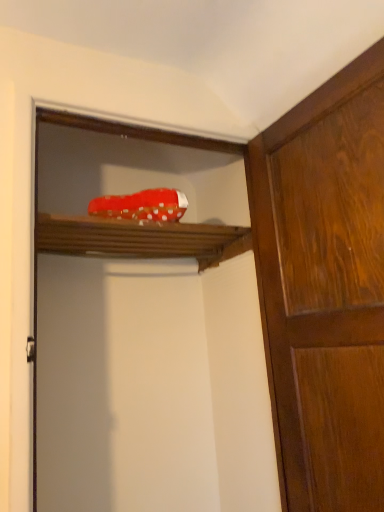
Measure the distance between wooden shelf at upper center and camera.

wooden shelf at upper center and camera are 1.16 meters apart from each other.

What do you see at coordinates (325, 287) in the screenshot? I see `wooden cabinet at right` at bounding box center [325, 287].

The height and width of the screenshot is (512, 384). Identify the location of wooden shelf at upper center. [140, 239].

Looking at their sizes, would you say red fabric shoe at upper center is wider or thinner than wooden shelf at upper center?

In the image, red fabric shoe at upper center appears to be more narrow than wooden shelf at upper center.

Which is in front, red fabric shoe at upper center or wooden shelf at upper center?

red fabric shoe at upper center is closer to the camera.

Does red fabric shoe at upper center have a smaller size compared to wooden shelf at upper center?

Actually, red fabric shoe at upper center might be larger than wooden shelf at upper center.

Is wooden cabinet at right closer to camera compared to wooden shelf at upper center?

Yes, the depth of wooden cabinet at right is less than that of wooden shelf at upper center.

Between point (282, 338) and point (155, 238), which one is positioned behind?

Point (155, 238)

From a real-world perspective, is wooden cabinet at right above or below wooden shelf at upper center?

Clearly, from a real-world perspective, wooden cabinet at right is below wooden shelf at upper center.

From the image's perspective, relative to wooden shelf at upper center, is wooden cabinet at right above or below?

Based on their image positions, wooden cabinet at right is located beneath wooden shelf at upper center.

Relative to wooden cabinet at right, is wooden shelf at upper center in front or behind?

Visually, wooden shelf at upper center is located behind wooden cabinet at right.

The height and width of the screenshot is (512, 384). There is a wooden cabinet at right. Identify the location of shelf above it (from a real-world perspective). (140, 239).

Considering the sizes of objects wooden shelf at upper center and wooden cabinet at right in the image provided, who is thinner, wooden shelf at upper center or wooden cabinet at right?

With smaller width is wooden cabinet at right.

Is wooden shelf at upper center positioned far away from wooden cabinet at right?

wooden shelf at upper center is actually quite close to wooden cabinet at right.

Is point (254, 415) positioned in front of point (331, 168)?

No.

Can you confirm if red fabric shoe at upper center is shorter than wooden cabinet at right?

Incorrect, the height of red fabric shoe at upper center does not fall short of that of wooden cabinet at right.

Is red fabric shoe at upper center oriented towards wooden cabinet at right?

Yes.

From the picture: How many degrees apart are the facing directions of red fabric shoe at upper center and wooden cabinet at right?

There is a 88.9-degree angle between the facing directions of red fabric shoe at upper center and wooden cabinet at right.

Can you confirm if wooden cabinet at right is thinner than red fabric shoe at upper center?

Yes, wooden cabinet at right is thinner than red fabric shoe at upper center.

From the image's perspective, is wooden cabinet at right located above or below red fabric shoe at upper center?

Clearly, from the image's perspective, wooden cabinet at right is above red fabric shoe at upper center.

Considering the sizes of wooden shelf at upper center and red fabric shoe at upper center in the image, is wooden shelf at upper center wider or thinner than red fabric shoe at upper center?

Considering their sizes, wooden shelf at upper center looks broader than red fabric shoe at upper center.

Does wooden shelf at upper center contain red fabric shoe at upper center?

No, red fabric shoe at upper center is located outside of wooden shelf at upper center.

Is wooden shelf at upper center next to red fabric shoe at upper center?

There is a gap between wooden shelf at upper center and red fabric shoe at upper center.

How many degrees apart are the facing directions of wooden shelf at upper center and red fabric shoe at upper center?

1.82 degrees separate the facing orientations of wooden shelf at upper center and red fabric shoe at upper center.

You are a GUI agent. You are given a task and a screenshot of the screen. Output one action in this format:
    pyautogui.click(x=<x>, y=<y>)
    Task: Click on the shelf that appears behind the red fabric shoe at upper center
    
    Given the screenshot: What is the action you would take?
    pyautogui.click(x=140, y=239)

In the image, there is a wooden cabinet at right. In order to click on shelf above it (from the image's perspective) in this screenshot , I will do `click(140, 239)`.

Which object lies nearer to the anchor point red fabric shoe at upper center, wooden cabinet at right or wooden shelf at upper center?

wooden shelf at upper center lies closer to red fabric shoe at upper center than the other object.

Considering their positions, is red fabric shoe at upper center positioned further to wooden cabinet at right than wooden shelf at upper center?

wooden shelf at upper center is further to wooden cabinet at right.

Considering their positions, is wooden cabinet at right positioned closer to wooden shelf at upper center than red fabric shoe at upper center?

The object closer to wooden shelf at upper center is red fabric shoe at upper center.

Based on their spatial positions, is wooden shelf at upper center or red fabric shoe at upper center closer to wooden cabinet at right?

red fabric shoe at upper center.

Consider the image. Considering their positions, is wooden shelf at upper center positioned closer to red fabric shoe at upper center than wooden cabinet at right?

Among the two, wooden shelf at upper center is located nearer to red fabric shoe at upper center.

Estimate the real-world distances between objects in this image. Which object is further from wooden shelf at upper center, red fabric shoe at upper center or wooden cabinet at right?

wooden cabinet at right is positioned further to the anchor wooden shelf at upper center.

Locate an element on the screen. The image size is (384, 512). screen door situated between wooden shelf at upper center and wooden cabinet at right from left to right is located at coordinates (148, 330).